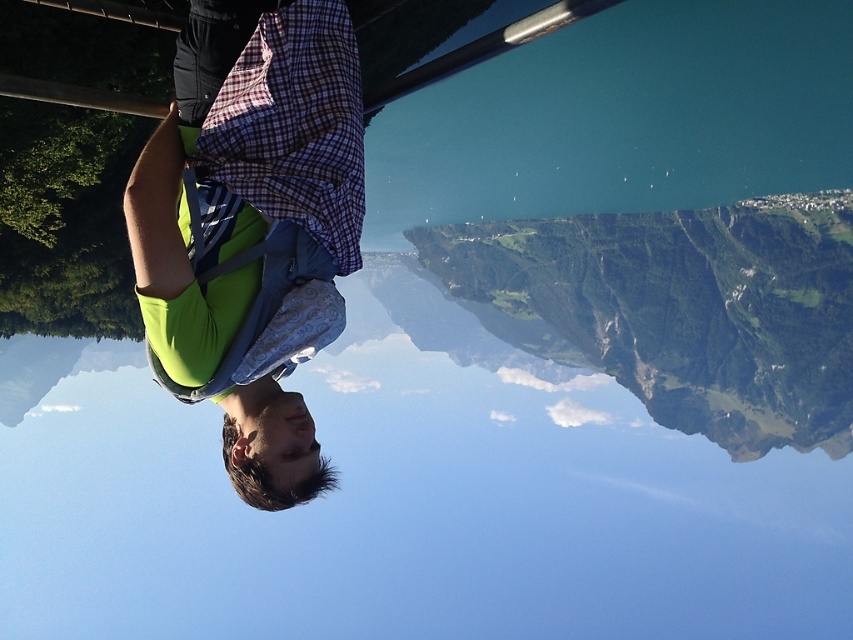
You are a photographer trying to capture a landscape photo of the green grassy mountain at upper right. However, the green fabric shirt at upper left is blocking your view. Which object should you move to the right to get an unobstructed view of the mountain?

You should move the green fabric shirt at upper left to the right since it is currently positioned to the left of the green grassy mountain at upper right, blocking the view. Moving it to the right would allow the mountain to be visible.

You are a photographer trying to capture the scene. You notice the green fabric shirt at upper left and the green grassy mountain at upper right. Which object takes up more area in the image?

The green grassy mountain at upper right takes up more area than the green fabric shirt at upper left.

From the picture: You are a photographer trying to capture the scene. You notice the green fabric shirt at upper left and the green grassy mountain at upper right. Which object would appear narrower in your photo?

The green fabric shirt at upper left is thinner than the green grassy mountain at upper right, so it would appear narrower in the photo.